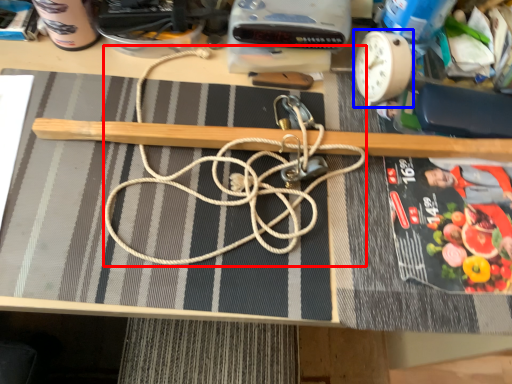
Question: Which point is further to the camera, string (highlighted by a red box) or clock (highlighted by a blue box)?

Choices:
 (A) string
 (B) clock

Answer: (B)